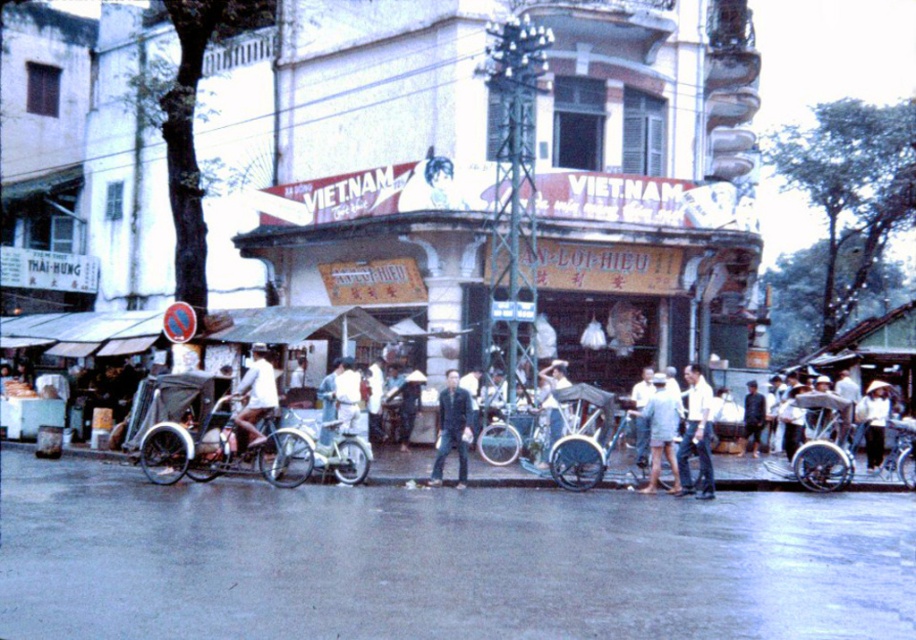
You are a delivery person who needs to choose a vehicle to carry a tall package. The package is 1.5 meters in height. You see a metallic silver tricycle at center and a white matte bicycle at center. Which vehicle can safely carry the package without the package exceeding the height limit?

The white matte bicycle at center is taller than the metallic silver tricycle at center. Since the package is 1.5 meters tall, the white matte bicycle at center would be the safer choice as it has a higher clearance.

You are a delivery person who needs to load a package onto the white matte bicycle at center. The package requires that it must be placed above the handlebars, which are at the same height as the dark blue denim jacket at center. Can you place the package there?

The dark blue denim jacket at center is taller than the white matte bicycle at center. Since the handlebars are at the same height as the jacket, the package cannot be placed above them because the bicycle is shorter than the jacket, meaning the handlebars are lower than the jacket.

You are a delivery person who needs to park your metallic silver tricycle at center and white matte bicycle at center close together. What is the minimum distance you need to leave between them to ensure they are touching?

The metallic silver tricycle at center is 23.74 inches away from white matte bicycle at center. To ensure they are touching, you can park them with no space between them, but according to the given distance, they are already 23.74 inches apart. However, if you want them to be touching, you would need to reduce the distance to 0 inches.